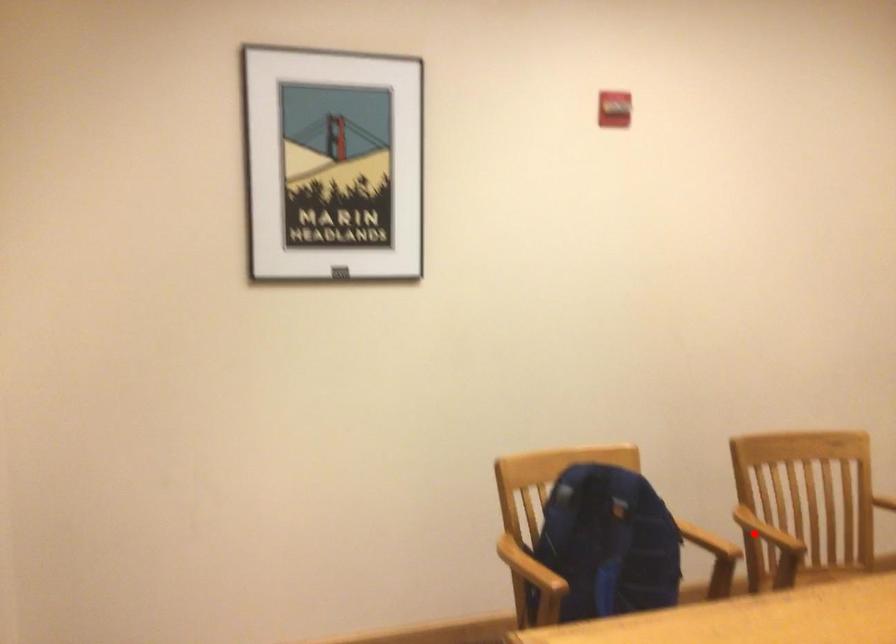
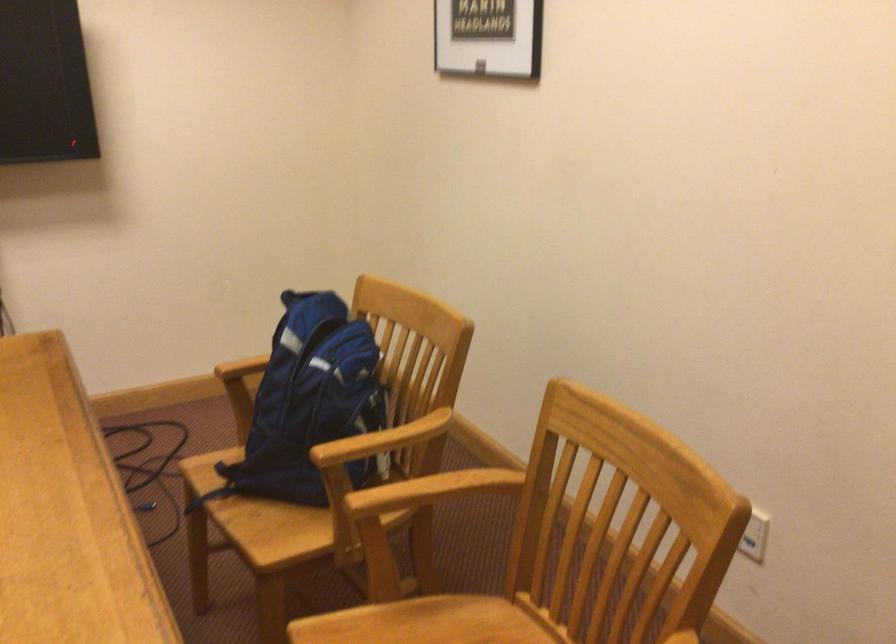
In the second image, find the point that corresponds to the highlighted location in the first image.

(436, 488)